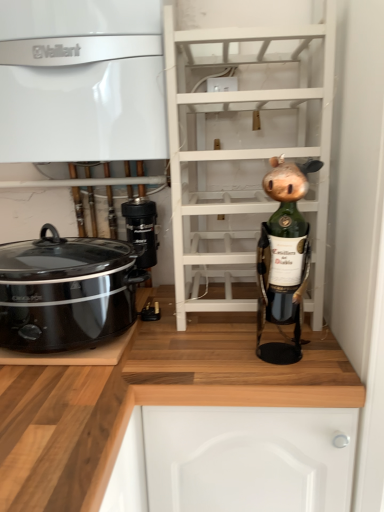
Image resolution: width=384 pixels, height=512 pixels. In order to click on vacant region to the right of green matte wine bottle at right in this screenshot , I will do `click(326, 354)`.